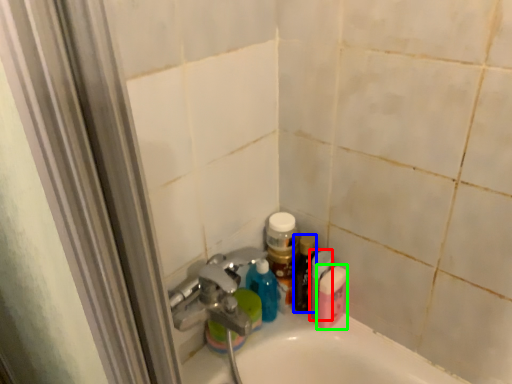
Question: Based on their relative distances, which object is farther from mouthwash (highlighted by a red box)? Choose from toiletry (highlighted by a blue box) and mouthwash (highlighted by a green box).

Choices:
 (A) toiletry
 (B) mouthwash

Answer: (A)